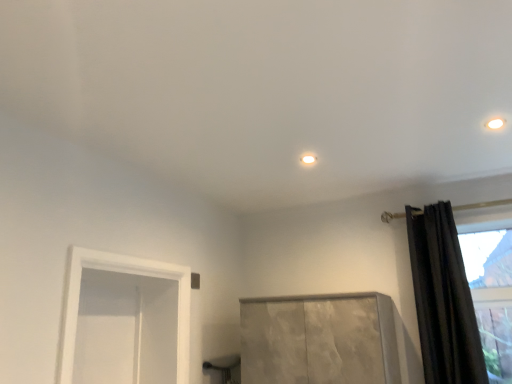
The height and width of the screenshot is (384, 512). Describe the element at coordinates (308, 159) in the screenshot. I see `white glossy light fixture at center, the second lighting positioned from the front` at that location.

The width and height of the screenshot is (512, 384). What do you see at coordinates (443, 299) in the screenshot?
I see `black velvet curtain at right` at bounding box center [443, 299].

The image size is (512, 384). I want to click on white glossy light fixture at center, the 1th lighting from the bottom, so point(308,159).

Locate an element on the screen. lighting behind the black velvet curtain at right is located at coordinates (308, 159).

Would you say black velvet curtain at right is inside or outside white glossy light fixture at center, the 1th lighting from the bottom?

The correct answer is: outside.

Is white glossy light fixture at center, positioned as the second lighting in top-to-bottom order, at the back of black velvet curtain at right?

No.

From the picture: From a real-world perspective, does black velvet curtain at right sit lower than white glossy light fixture at center, the 1th lighting from the bottom?

Yes, from a real-world perspective, black velvet curtain at right is beneath white glossy light fixture at center, the 1th lighting from the bottom.

Is matte white light fixture at upper right, placed as the second lighting when sorted from left to right, oriented towards white glossy light fixture at center, the 1th lighting from the bottom?

No.

Does matte white light fixture at upper right, arranged as the first lighting when viewed from the front, appear on the left side of white glossy light fixture at center, the second lighting when ordered from right to left?

No.

Which object is further away from the camera taking this photo, matte white light fixture at upper right, positioned as the 1th lighting in top-to-bottom order, or white glossy light fixture at center, the second lighting positioned from the front?

white glossy light fixture at center, the second lighting positioned from the front, is behind.

Between point (305, 155) and point (440, 357), which one is positioned behind?

Positioned behind is point (440, 357).

From a real-world perspective, is white glossy light fixture at center, positioned as the second lighting in top-to-bottom order, below black velvet curtain at right?

No, from a real-world perspective, white glossy light fixture at center, positioned as the second lighting in top-to-bottom order, is not below black velvet curtain at right.

Considering the relative sizes of white glossy light fixture at center, positioned as the second lighting in top-to-bottom order, and black velvet curtain at right in the image provided, is white glossy light fixture at center, positioned as the second lighting in top-to-bottom order, bigger than black velvet curtain at right?

No, white glossy light fixture at center, positioned as the second lighting in top-to-bottom order, is not bigger than black velvet curtain at right.

Considering the positions of objects white glossy light fixture at center, the 1th lighting from the bottom, and black velvet curtain at right in the image provided, who is more to the left, white glossy light fixture at center, the 1th lighting from the bottom, or black velvet curtain at right?

Positioned to the left is white glossy light fixture at center, the 1th lighting from the bottom.

Is matte white light fixture at upper right, the second lighting when ordered from bottom to top, oriented away from black velvet curtain at right?

No, matte white light fixture at upper right, the second lighting when ordered from bottom to top, is not facing the opposite direction of black velvet curtain at right.

There is a black velvet curtain at right. Where is `the 1st lighting above it (from a real-world perspective)`? the 1st lighting above it (from a real-world perspective) is located at coordinates [495, 124].

Considering the positions of objects matte white light fixture at upper right, which is the first lighting in right-to-left order, and black velvet curtain at right in the image provided, who is more to the right, matte white light fixture at upper right, which is the first lighting in right-to-left order, or black velvet curtain at right?

From the viewer's perspective, matte white light fixture at upper right, which is the first lighting in right-to-left order, appears more on the right side.

Is white glossy light fixture at center, which appears as the first lighting when viewed from the left, positioned beyond the bounds of matte white light fixture at upper right, positioned as the 1th lighting in top-to-bottom order?

Yes, white glossy light fixture at center, which appears as the first lighting when viewed from the left, is located beyond the bounds of matte white light fixture at upper right, positioned as the 1th lighting in top-to-bottom order.

Identify the location of lighting above the matte white light fixture at upper right, arranged as the second lighting when viewed from the back (from a real-world perspective). (308, 159).

Does white glossy light fixture at center, which appears as the first lighting when viewed from the left, appear on the right side of matte white light fixture at upper right, arranged as the second lighting when viewed from the back?

No, white glossy light fixture at center, which appears as the first lighting when viewed from the left, is not to the right of matte white light fixture at upper right, arranged as the second lighting when viewed from the back.

Can you tell me how much black velvet curtain at right and matte white light fixture at upper right, placed as the second lighting when sorted from left to right, differ in facing direction?

The facing directions of black velvet curtain at right and matte white light fixture at upper right, placed as the second lighting when sorted from left to right, are 5.11 degrees apart.

Can you confirm if black velvet curtain at right is wider than matte white light fixture at upper right, placed as the second lighting when sorted from left to right?

Correct, the width of black velvet curtain at right exceeds that of matte white light fixture at upper right, placed as the second lighting when sorted from left to right.

Where is `curtain lying on the left of matte white light fixture at upper right, the second lighting when ordered from bottom to top`? The image size is (512, 384). curtain lying on the left of matte white light fixture at upper right, the second lighting when ordered from bottom to top is located at coordinates (443, 299).

Looking at this image, from the image's perspective, which is below, black velvet curtain at right or matte white light fixture at upper right, arranged as the first lighting when viewed from the front?

black velvet curtain at right.

Identify the location of curtain on the right of white glossy light fixture at center, marked as the 1th lighting in a back-to-front arrangement. (443, 299).

You are a GUI agent. You are given a task and a screenshot of the screen. Output one action in this format:
    pyautogui.click(x=<x>, y=<y>)
    Task: Click on the lighting below the matte white light fixture at upper right, arranged as the second lighting when viewed from the back (from the image's perspective)
    
    Given the screenshot: What is the action you would take?
    pyautogui.click(x=308, y=159)

When comparing their distances from white glossy light fixture at center, which appears as the first lighting when viewed from the left, does matte white light fixture at upper right, which is the first lighting in right-to-left order, or black velvet curtain at right seem closer?

The object closer to white glossy light fixture at center, which appears as the first lighting when viewed from the left, is matte white light fixture at upper right, which is the first lighting in right-to-left order.

From the picture: Estimate the real-world distances between objects in this image. Which object is closer to black velvet curtain at right, white glossy light fixture at center, marked as the 1th lighting in a back-to-front arrangement, or matte white light fixture at upper right, the second lighting when ordered from bottom to top?

matte white light fixture at upper right, the second lighting when ordered from bottom to top, is positioned closer to the anchor black velvet curtain at right.

Based on their spatial positions, is matte white light fixture at upper right, arranged as the second lighting when viewed from the back, or white glossy light fixture at center, which appears as the first lighting when viewed from the left, closer to black velvet curtain at right?

The object closer to black velvet curtain at right is matte white light fixture at upper right, arranged as the second lighting when viewed from the back.

Which object lies nearer to the anchor point white glossy light fixture at center, the 1th lighting from the bottom, black velvet curtain at right or matte white light fixture at upper right, placed as the second lighting when sorted from left to right?

matte white light fixture at upper right, placed as the second lighting when sorted from left to right, lies closer to white glossy light fixture at center, the 1th lighting from the bottom, than the other object.

Based on their spatial positions, is white glossy light fixture at center, positioned as the second lighting in top-to-bottom order, or black velvet curtain at right further from matte white light fixture at upper right, the second lighting when ordered from bottom to top?

black velvet curtain at right is positioned further to the anchor matte white light fixture at upper right, the second lighting when ordered from bottom to top.

From the image, which object appears to be nearer to matte white light fixture at upper right, the second lighting when ordered from bottom to top, black velvet curtain at right or white glossy light fixture at center, positioned as the second lighting in top-to-bottom order?

The object closer to matte white light fixture at upper right, the second lighting when ordered from bottom to top, is white glossy light fixture at center, positioned as the second lighting in top-to-bottom order.

This screenshot has height=384, width=512. Identify the location of lighting between matte white light fixture at upper right, placed as the second lighting when sorted from left to right, and black velvet curtain at right vertically. (308, 159).